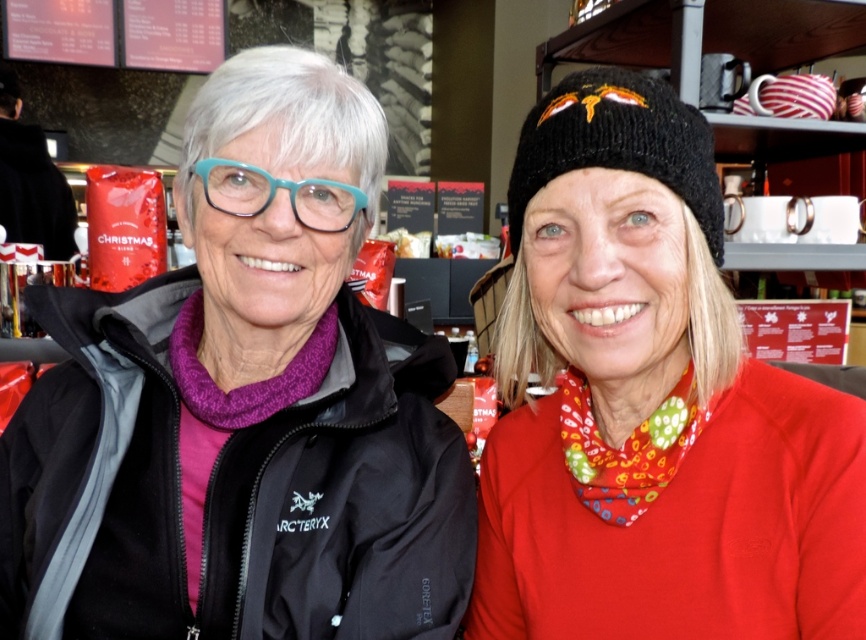
Question: Which point is farther to the camera?

Choices:
 (A) (551, 148)
 (B) (81, 497)
 (C) (501, 497)
 (D) (343, 198)

Answer: (C)

Question: From the image, what is the correct spatial relationship of black knitted hat at upper right in relation to teal plastic glasses at center?

Choices:
 (A) left
 (B) right

Answer: (B)

Question: Does black matte jacket at center lie in front of black knitted hat at upper right?

Choices:
 (A) no
 (B) yes

Answer: (A)

Question: Estimate the real-world distances between objects in this image. Which object is farther from the black knitted beanie at upper center?

Choices:
 (A) black knitted hat at upper right
 (B) teal plastic glasses at center
 (C) black matte jacket at center

Answer: (B)

Question: Is black matte jacket at center below teal plastic glasses at center?

Choices:
 (A) yes
 (B) no

Answer: (A)

Question: Which object is the farthest from the teal plastic glasses at center?

Choices:
 (A) black knitted hat at upper right
 (B) black knitted beanie at upper center

Answer: (B)